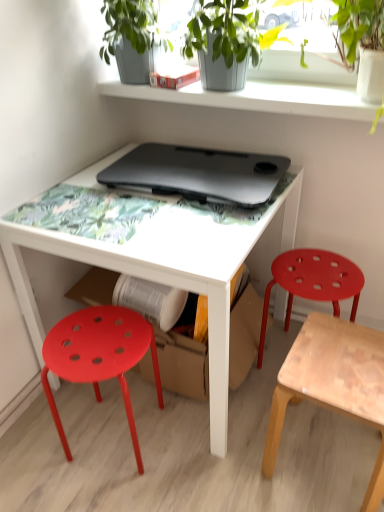
This screenshot has height=512, width=384. Find the location of `vacant space situated on the left part of matte plastic stool at lower left, which ranks as the 3th stool in right-to-left order`. vacant space situated on the left part of matte plastic stool at lower left, which ranks as the 3th stool in right-to-left order is located at coordinates (43, 441).